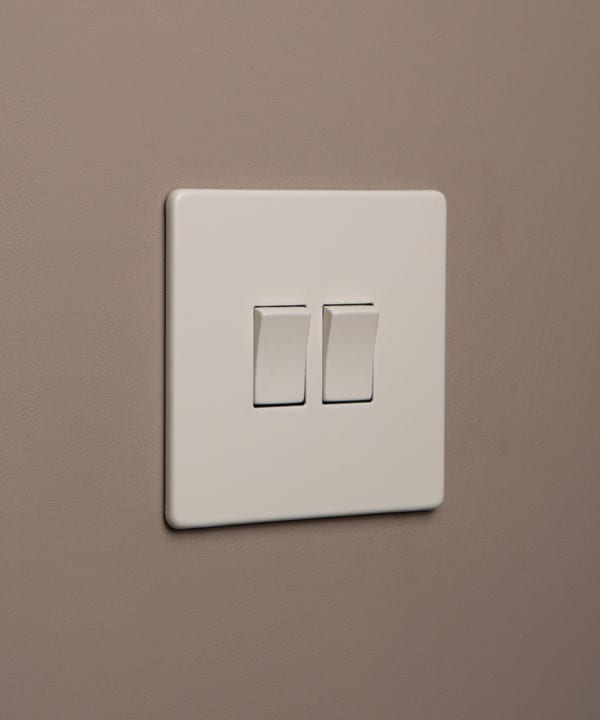
Where is `left switch`? This screenshot has width=600, height=720. left switch is located at coordinates tap(270, 387).